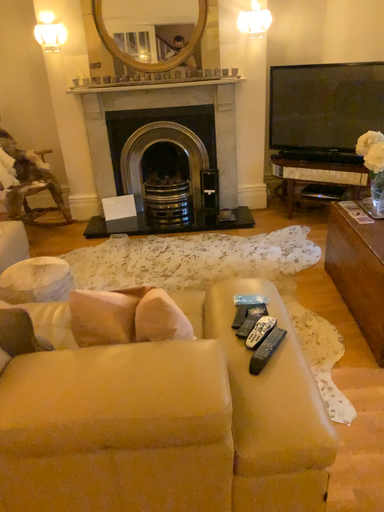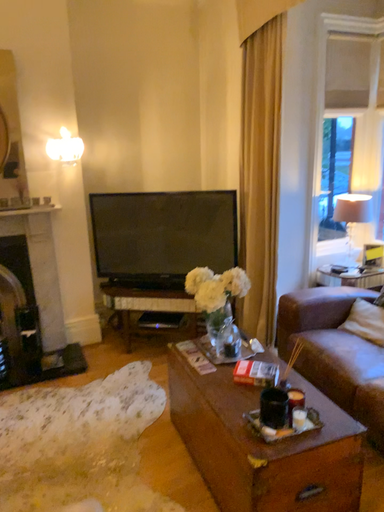
Question: How did the camera likely rotate when shooting the video?

Choices:
 (A) rotated upward
 (B) rotated downward

Answer: (A)